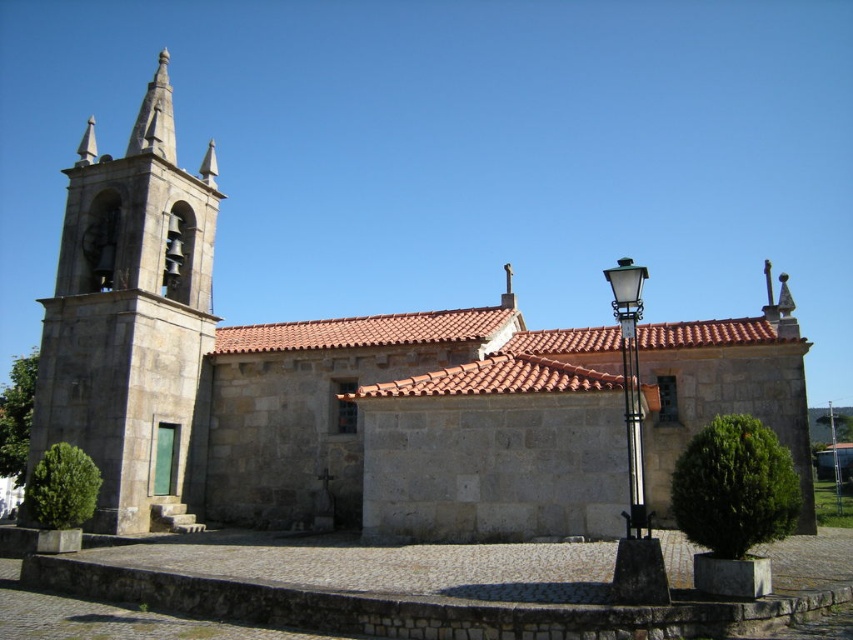
Is stone bell tower at left below black metal/iron streetlight at right?

No.

Consider the image. Which is above, stone bell tower at left or black metal/iron streetlight at right?

stone bell tower at left

Is point (32, 460) positioned before point (633, 337)?

No.

Locate an element on the screen. stone bell tower at left is located at coordinates (131, 316).

Is stone church at left taller than black metal/iron streetlight at right?

Yes.

Does stone church at left have a lesser height compared to black metal/iron streetlight at right?

No, stone church at left is not shorter than black metal/iron streetlight at right.

The height and width of the screenshot is (640, 853). What do you see at coordinates (276, 371) in the screenshot?
I see `stone church at left` at bounding box center [276, 371].

This screenshot has height=640, width=853. I want to click on stone church at left, so click(276, 371).

Does stone church at left appear under stone bell tower at left?

Indeed, stone church at left is positioned under stone bell tower at left.

What are the coordinates of `stone church at left` in the screenshot? It's located at (276, 371).